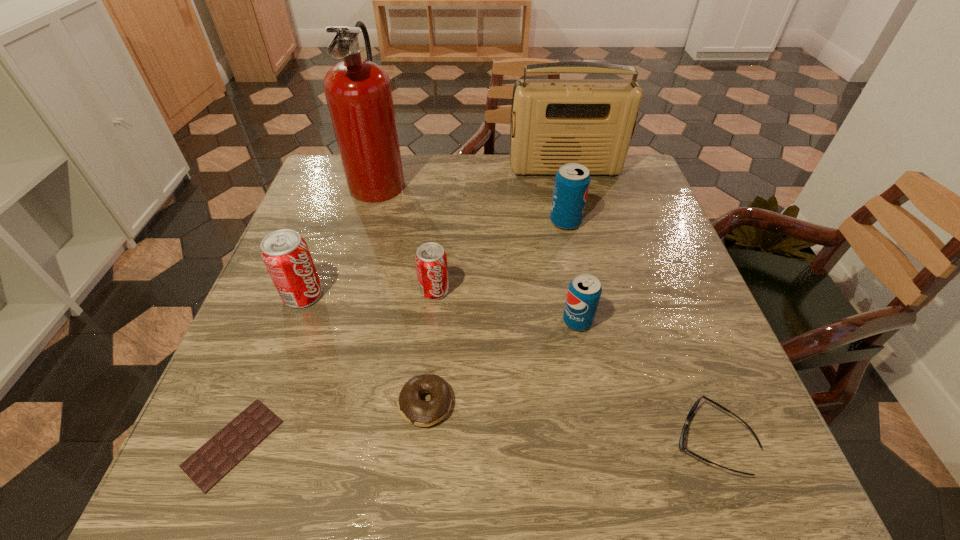
In order to click on the tallest object in this screenshot , I will do `click(358, 92)`.

Where is `red fire extinguisher`? This screenshot has width=960, height=540. red fire extinguisher is located at coordinates [358, 92].

The height and width of the screenshot is (540, 960). I want to click on radio receiver, so click(591, 122).

In order to click on beige radio receiver in this screenshot , I will do (591, 122).

You are a GUI agent. You are given a task and a screenshot of the screen. Output one action in this format:
    pyautogui.click(x=<x>, y=<y>)
    Task: Click on the bigger blue soda can
    The height and width of the screenshot is (540, 960).
    Given the screenshot: What is the action you would take?
    pyautogui.click(x=572, y=181)

This screenshot has width=960, height=540. In order to click on the farther blue soda can in this screenshot , I will do `click(572, 181)`.

Find the location of a particular element. the leftmost soda can is located at coordinates (286, 256).

This screenshot has height=540, width=960. I want to click on the bigger red soda can, so click(286, 256).

At what (x,y) coordinates should I click in order to perform the action: click on the right red soda can. Please return your answer as a coordinate pair (x, y). The width and height of the screenshot is (960, 540). Looking at the image, I should click on (431, 260).

This screenshot has height=540, width=960. What are the coordinates of `the smaller red soda can` in the screenshot? It's located at (431, 260).